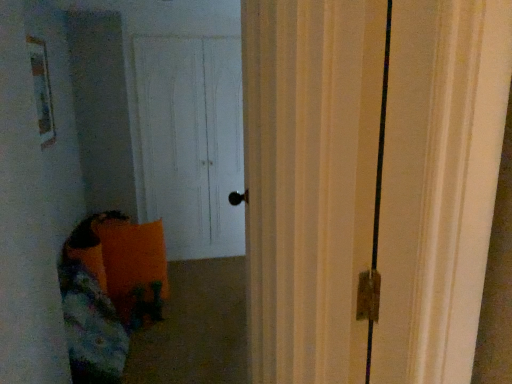
Image resolution: width=512 pixels, height=384 pixels. Describe the element at coordinates (192, 141) in the screenshot. I see `white matte door at center` at that location.

The image size is (512, 384). Identify the location of white matte door at center. (192, 141).

Measure the distance between point (192,231) and camera.

Point (192,231) and camera are 3.86 meters apart from each other.

What is the approximate width of white matte door at center?

white matte door at center is 27.45 inches wide.

At what (x,y) coordinates should I click in order to perform the action: click on white matte door at center. Please return your answer as a coordinate pair (x, y). The height and width of the screenshot is (384, 512). Looking at the image, I should click on (192, 141).